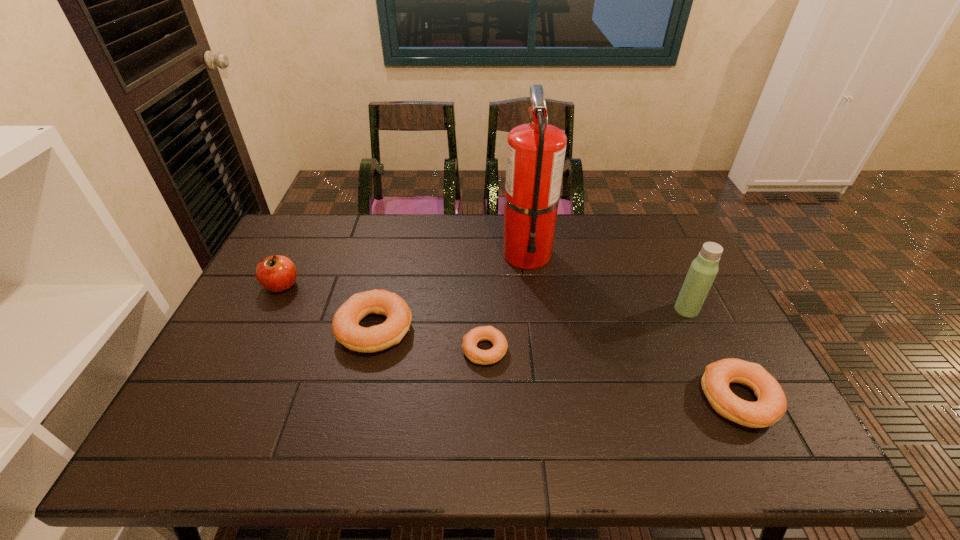
You are a GUI agent. You are given a task and a screenshot of the screen. Output one action in this format:
    pyautogui.click(x=<x>, y=<y>)
    Task: Click on the thermos bottle that is positioned at the right edge
    The height and width of the screenshot is (540, 960).
    Given the screenshot: What is the action you would take?
    pyautogui.click(x=704, y=268)

Find the location of `object present at the near right corner`. object present at the near right corner is located at coordinates (771, 405).

This screenshot has width=960, height=540. Identify the location of free space at the far edge of the desktop. (402, 243).

At what (x,y) coordinates should I click in order to perform the action: click on vacant space at the near edge of the desktop. Please return your answer as a coordinate pair (x, y). Image resolution: width=960 pixels, height=540 pixels. Looking at the image, I should click on (610, 408).

At what (x,y) coordinates should I click in order to perform the action: click on vacant space at the left edge of the desktop. Please return your answer as a coordinate pair (x, y). Looking at the image, I should click on (279, 330).

Image resolution: width=960 pixels, height=540 pixels. What are the coordinates of `vacant area at the right edge` in the screenshot? It's located at (696, 334).

You are a GUI agent. You are given a task and a screenshot of the screen. Output one action in this format:
    pyautogui.click(x=<x>, y=<y>)
    Task: Click on the free spot at the far left corner of the desktop
    This screenshot has height=540, width=960.
    Given the screenshot: What is the action you would take?
    pyautogui.click(x=306, y=219)

In the image, there is a desktop. At what (x,y) coordinates should I click in order to perform the action: click on free space at the far right corner. Please return your answer as a coordinate pair (x, y). This screenshot has width=960, height=540. Looking at the image, I should click on (666, 215).

Find the location of a particular element. This screenshot has height=540, width=960. free space between the fifth tallest object and the fifth shortest object is located at coordinates (712, 354).

Where is `free spot between the second tallest bagel and the fourth object from left to right`? This screenshot has width=960, height=540. free spot between the second tallest bagel and the fourth object from left to right is located at coordinates (633, 326).